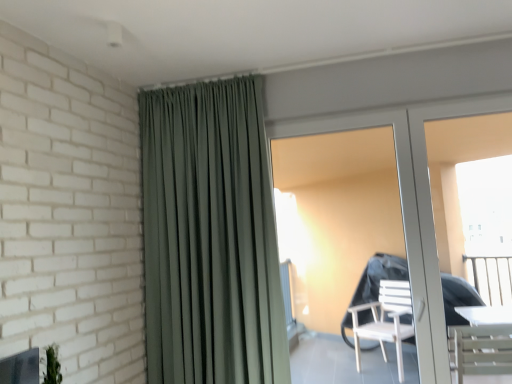
This screenshot has height=384, width=512. I want to click on blank space situated above white glossy door at center (from a real-world perspective), so click(x=438, y=101).